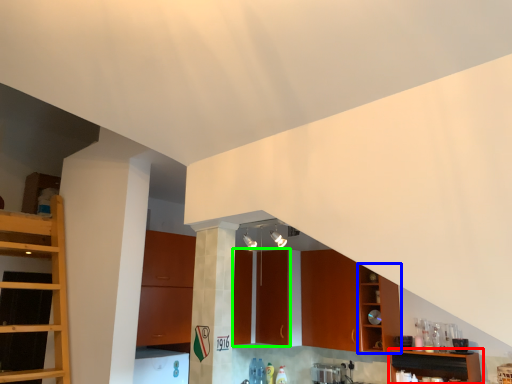
Question: Which object is positioned closest to shelf (highlighted by a red box)? Select from cabinetry (highlighted by a blue box) and cabinetry (highlighted by a green box).

Choices:
 (A) cabinetry
 (B) cabinetry

Answer: (A)